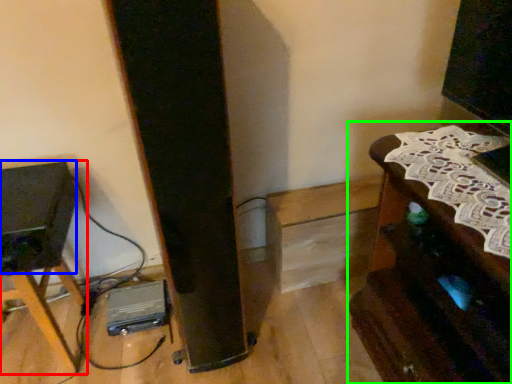
Question: Which object is the closest to the furniture (highlighted by a red box)? Choose among these: speaker (highlighted by a blue box) or furniture (highlighted by a green box).

Choices:
 (A) speaker
 (B) furniture

Answer: (A)